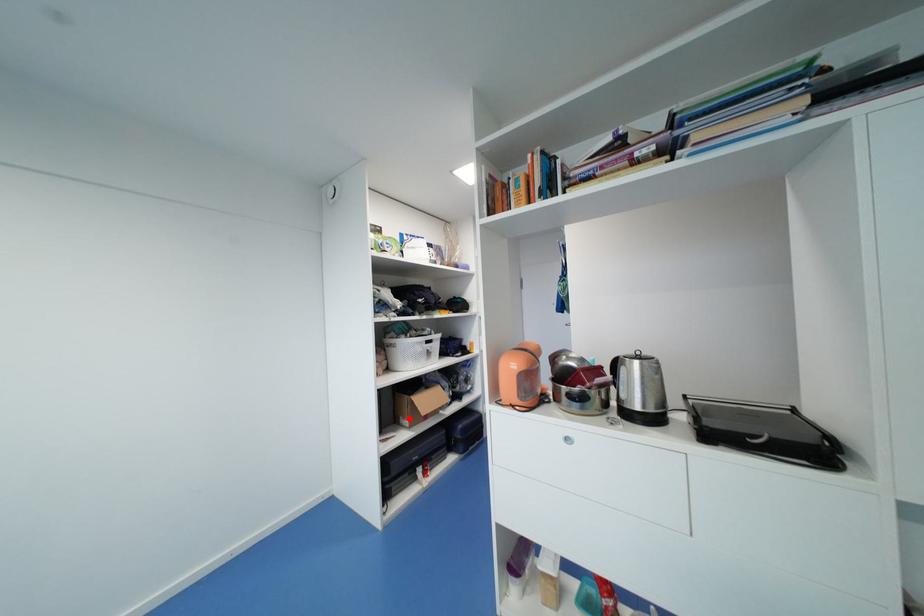
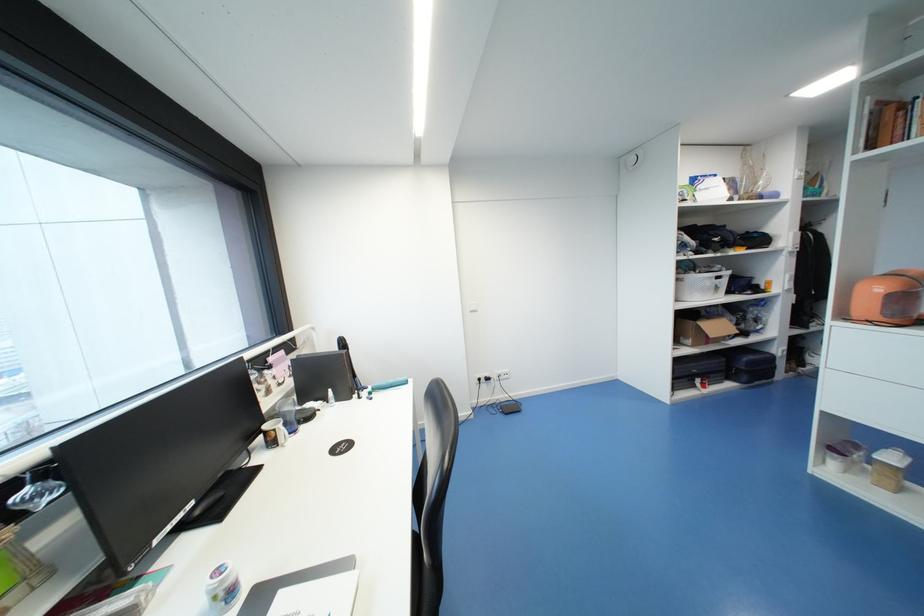
Locate, in the second image, the point that corresponds to the highlighted location in the first image.

(690, 339)